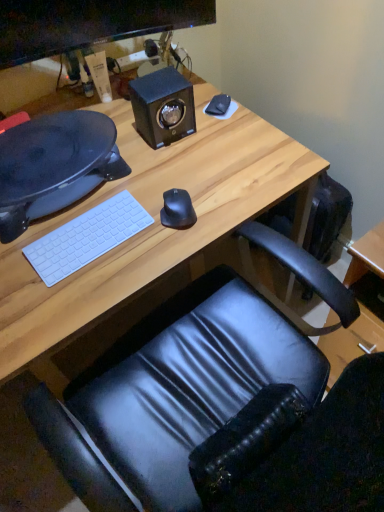
Where is `free area in between white matte keyboard at lower left and black matte notepad at upper right`? This screenshot has width=384, height=512. free area in between white matte keyboard at lower left and black matte notepad at upper right is located at coordinates (158, 167).